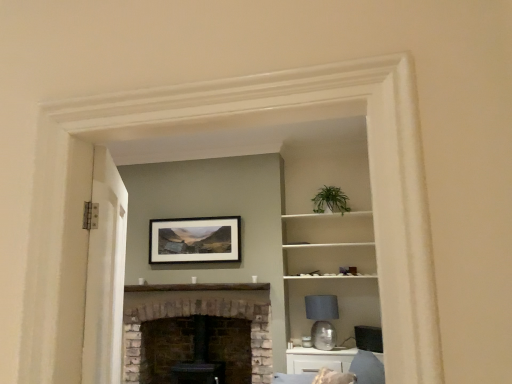
Question: Considering the relative positions of white stone fireplace at center and white painted wood door at left in the image provided, is white stone fireplace at center to the right of white painted wood door at left from the viewer's perspective?

Choices:
 (A) no
 (B) yes

Answer: (A)

Question: Is white painted wood door at left inside white stone fireplace at center?

Choices:
 (A) yes
 (B) no

Answer: (B)

Question: Is white stone fireplace at center far away from white painted wood door at left?

Choices:
 (A) no
 (B) yes

Answer: (B)

Question: Is white stone fireplace at center closer to camera compared to white painted wood door at left?

Choices:
 (A) no
 (B) yes

Answer: (A)

Question: Is white stone fireplace at center wider than white painted wood door at left?

Choices:
 (A) yes
 (B) no

Answer: (A)

Question: Is white stone fireplace at center positioned behind white painted wood door at left?

Choices:
 (A) no
 (B) yes

Answer: (B)

Question: Can you confirm if white glossy cabinet at lower right is positioned to the right of white painted wood door at left?

Choices:
 (A) yes
 (B) no

Answer: (A)

Question: Considering the relative sizes of white glossy cabinet at lower right and white painted wood door at left in the image provided, is white glossy cabinet at lower right smaller than white painted wood door at left?

Choices:
 (A) no
 (B) yes

Answer: (B)

Question: Can we say white glossy cabinet at lower right lies outside white painted wood door at left?

Choices:
 (A) yes
 (B) no

Answer: (A)

Question: Can you confirm if white glossy cabinet at lower right is shorter than white painted wood door at left?

Choices:
 (A) yes
 (B) no

Answer: (A)

Question: Is white glossy cabinet at lower right thinner than white painted wood door at left?

Choices:
 (A) no
 (B) yes

Answer: (A)

Question: Is white glossy cabinet at lower right far away from white painted wood door at left?

Choices:
 (A) no
 (B) yes

Answer: (B)

Question: Can white glossy cabinet at lower right be found inside matte gray glass lampshade at center-right?

Choices:
 (A) yes
 (B) no

Answer: (B)